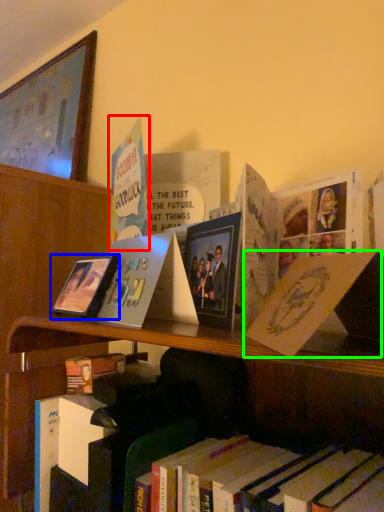
Question: Based on their relative distances, which object is nearer to book (highlighted by a red box)? Choose from picture frame (highlighted by a blue box) and paperback book (highlighted by a green box).

Choices:
 (A) picture frame
 (B) paperback book

Answer: (A)